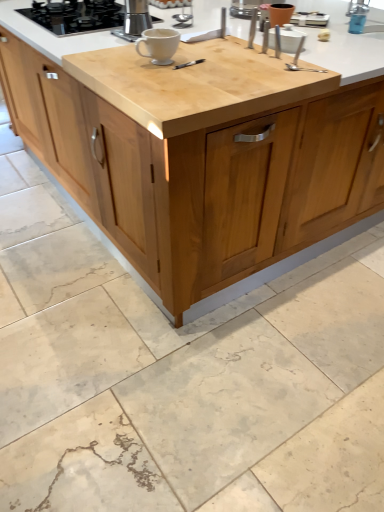
Question: Does light brown wood cabinet at center appear on the left side of black glass gas stove at upper left?

Choices:
 (A) no
 (B) yes

Answer: (A)

Question: Is light brown wood cabinet at center further to the viewer compared to black glass gas stove at upper left?

Choices:
 (A) no
 (B) yes

Answer: (A)

Question: Can you confirm if light brown wood cabinet at center is thinner than black glass gas stove at upper left?

Choices:
 (A) yes
 (B) no

Answer: (B)

Question: Is light brown wood cabinet at center bigger than black glass gas stove at upper left?

Choices:
 (A) yes
 (B) no

Answer: (A)

Question: Could you tell me if light brown wood cabinet at center is facing black glass gas stove at upper left?

Choices:
 (A) yes
 (B) no

Answer: (B)

Question: From a real-world perspective, does light brown wood cabinet at center stand above black glass gas stove at upper left?

Choices:
 (A) no
 (B) yes

Answer: (A)

Question: From a real-world perspective, does satin silver espresso maker at upper center sit lower than white glossy mug at center?

Choices:
 (A) yes
 (B) no

Answer: (B)

Question: Is satin silver espresso maker at upper center to the right of white glossy mug at center from the viewer's perspective?

Choices:
 (A) yes
 (B) no

Answer: (B)

Question: Does satin silver espresso maker at upper center have a lesser height compared to white glossy mug at center?

Choices:
 (A) yes
 (B) no

Answer: (B)

Question: Is there a large distance between satin silver espresso maker at upper center and white glossy mug at center?

Choices:
 (A) yes
 (B) no

Answer: (B)

Question: From the image's perspective, is satin silver espresso maker at upper center below white glossy mug at center?

Choices:
 (A) no
 (B) yes

Answer: (A)

Question: Is satin silver espresso maker at upper center next to white glossy mug at center?

Choices:
 (A) no
 (B) yes

Answer: (A)

Question: From the image's perspective, is blue plastic faucet at upper right over light brown wood cabinet at center?

Choices:
 (A) yes
 (B) no

Answer: (B)